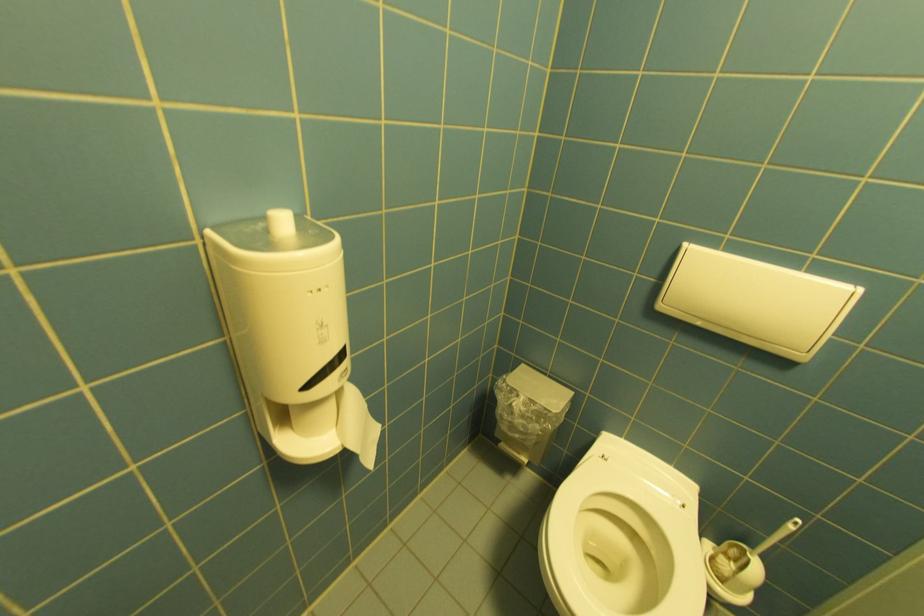
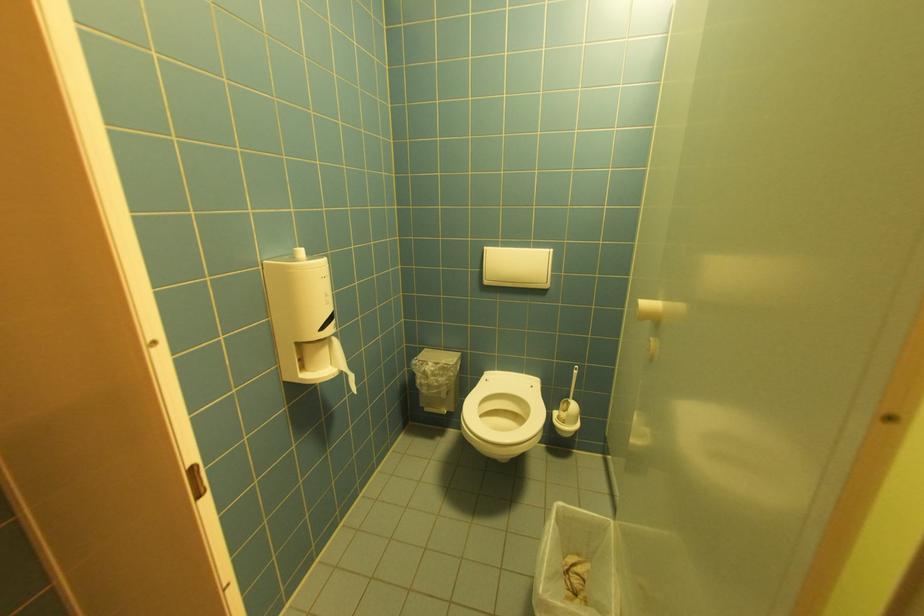
Find the pixel in the second image that matches point (690, 507) in the first image.

(538, 387)